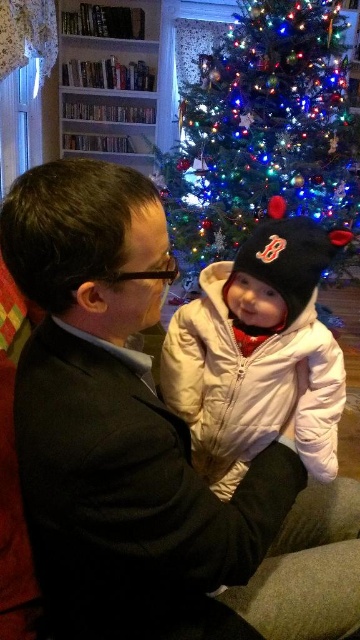
You are a photographer standing in front of the scene. You want to take a photo of the white puffy coat at center without the iridescent plastic christmas tree at upper center appearing in the frame. Is this possible?

The iridescent plastic christmas tree at upper center is located above the white puffy coat at center, so if you lower your camera angle to avoid capturing the upper part of the scene, you can take a photo of the white puffy coat at center without the tree appearing in the frame.

You are a photographer trying to capture a photo of the baby in the white puffy coat at center. The man in the dark suit at center is blocking your view. Can you move the man to the right to get a clear shot of the baby?

The dark suit at center is already to the left of the white puffy coat at center. Moving the man to the right would place him further away from the baby, which is at center, so yes, moving the dark suit at center to the right would allow you to see the white puffy coat at center clearly.

Based on the provided scene description, what are the coordinates of the iridescent plastic christmas tree at upper center?

The coordinates of the iridescent plastic christmas tree at upper center are at point (263, 131).